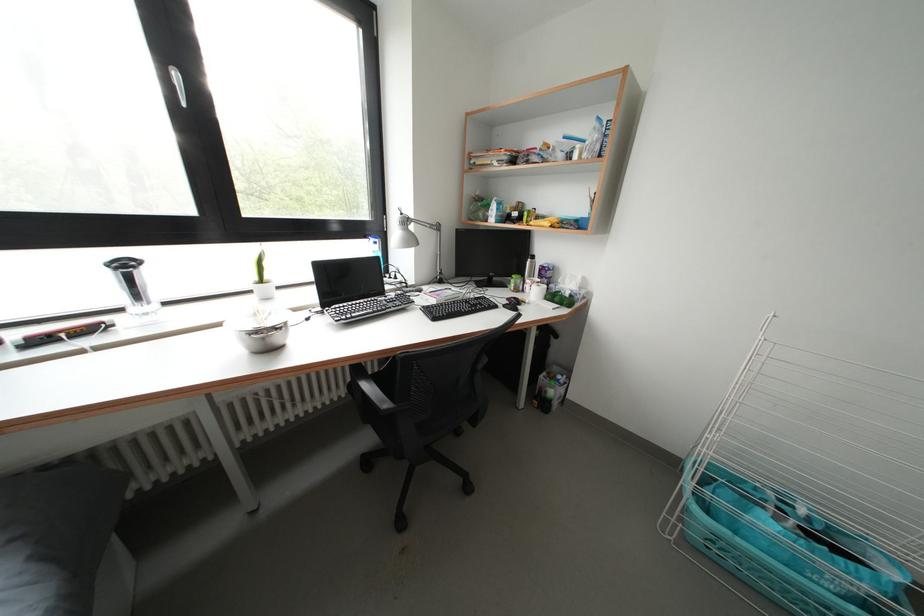
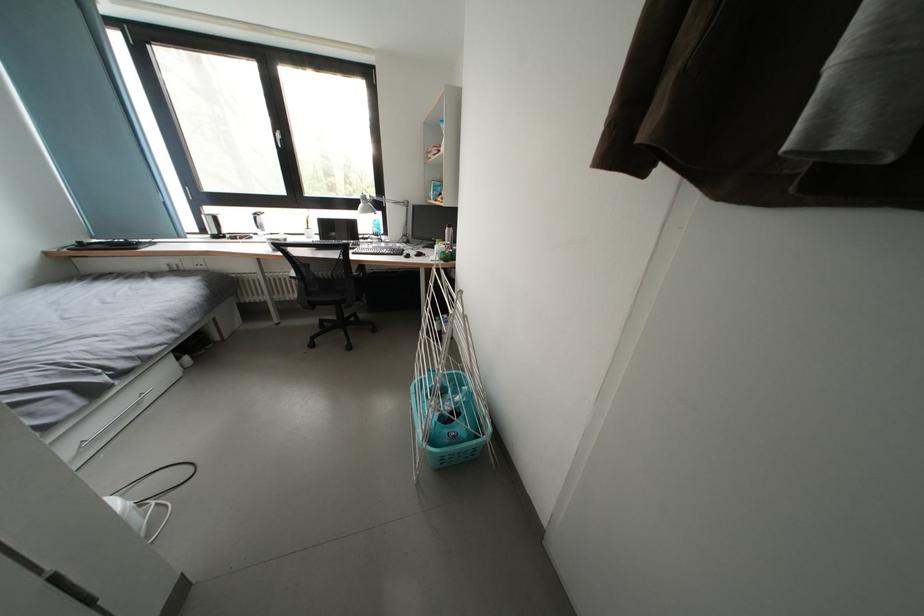
Find the pixel in the second image that matches (x=371, y=241) in the first image.

(377, 215)